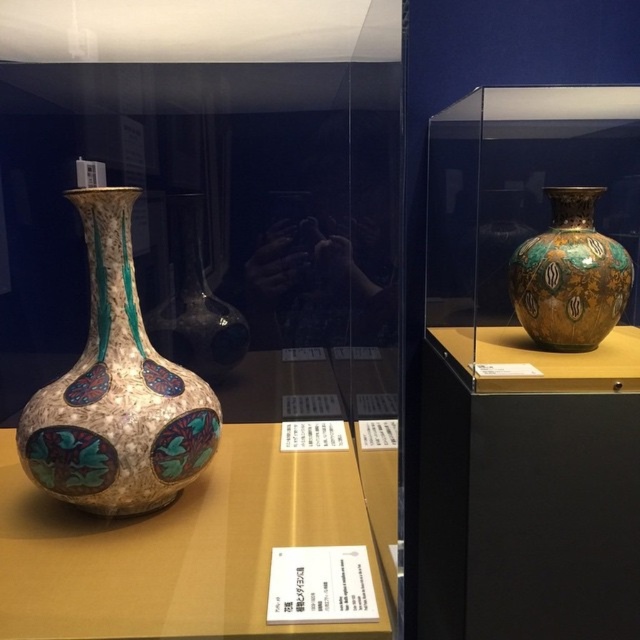
Question: From the image, what is the correct spatial relationship of matte glass vase at left in relation to gold metallic vase at center?

Choices:
 (A) above
 (B) below

Answer: (A)

Question: In this image, where is gold metallic vase at center located relative to matte ceramic vase at lower left?

Choices:
 (A) right
 (B) left

Answer: (A)

Question: Which of the following is the farthest from the observer?

Choices:
 (A) (17, 468)
 (B) (193, 276)
 (C) (518, 275)

Answer: (C)

Question: Is enamel vase at left to the left of gold and turquoise mosaic vase at right from the viewer's perspective?

Choices:
 (A) yes
 (B) no

Answer: (A)

Question: Which point is farther from the camera taking this photo?

Choices:
 (A) (6, 449)
 (B) (113, 380)

Answer: (A)

Question: Which object appears closest to the camera in this image?

Choices:
 (A) gold and turquoise mosaic vase at right
 (B) gold metallic vase at center
 (C) enamel vase at center
 (D) matte ceramic vase at lower left

Answer: (D)